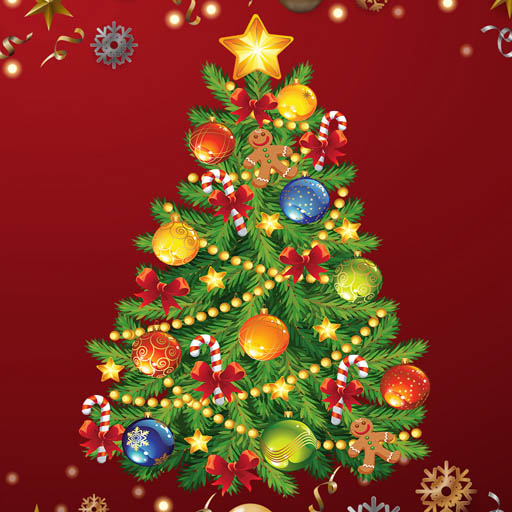
Image resolution: width=512 pixels, height=512 pixels. I want to click on lights, so click(x=250, y=396).